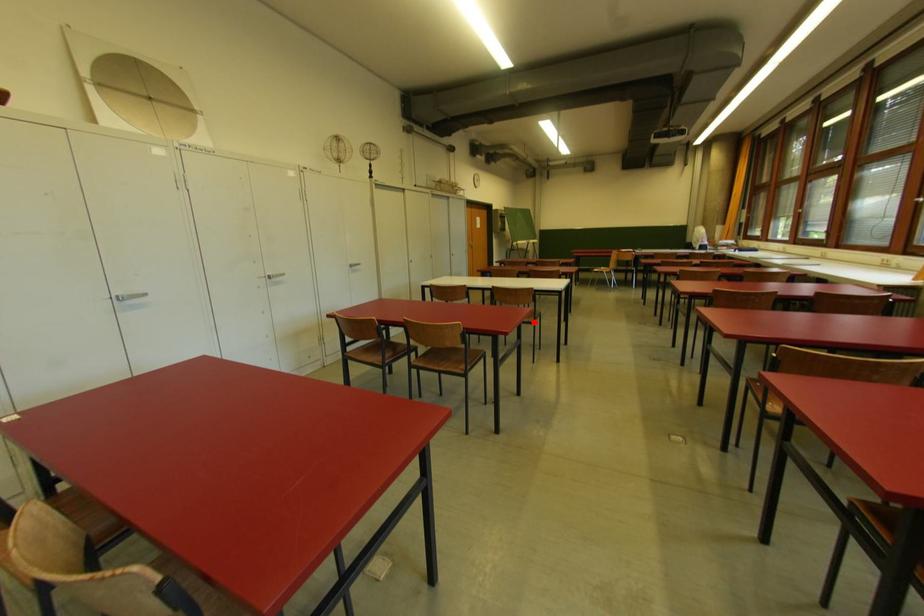
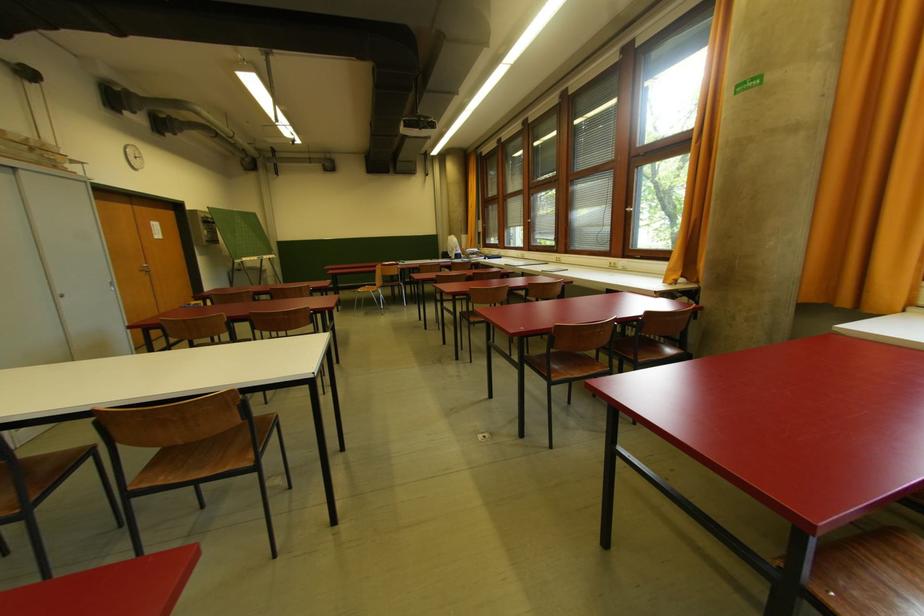
Locate, in the second image, the point that corresponds to the highlighted location in the first image.

(250, 467)